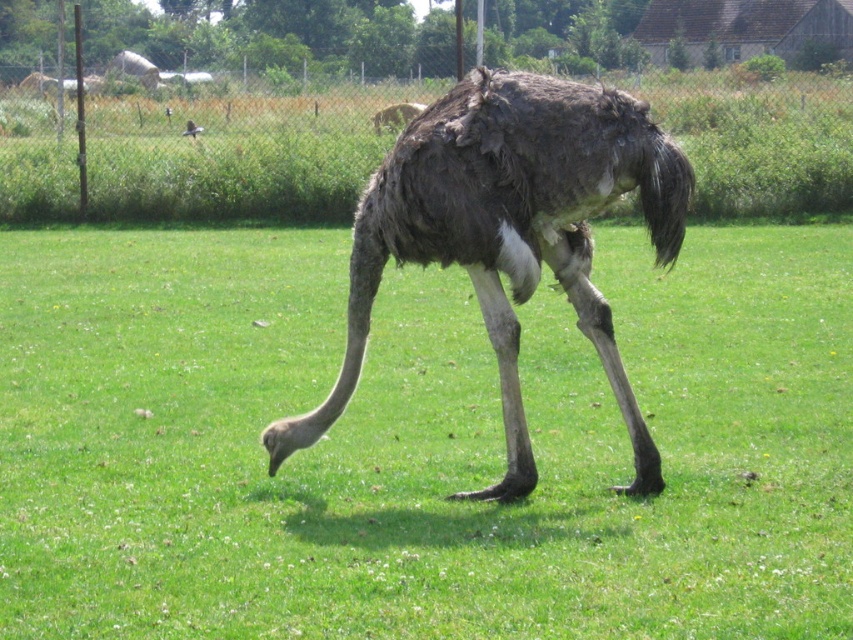
Is dark brown feathers at center positioned at the back of brown feathered ostrich at center?

No, it is not.

Between point (548, 192) and point (399, 106), which one is positioned behind?

The point (399, 106) is more distant.

Find the location of a particular element. The height and width of the screenshot is (640, 853). dark brown feathers at center is located at coordinates (509, 232).

Can you confirm if green grass at center is shorter than dark brown feathers at center?

Correct, green grass at center is not as tall as dark brown feathers at center.

Does green grass at center lie behind dark brown feathers at center?

No, green grass at center is in front of dark brown feathers at center.

You are a GUI agent. You are given a task and a screenshot of the screen. Output one action in this format:
    pyautogui.click(x=<x>, y=<y>)
    Task: Click on the green grass at center
    The height and width of the screenshot is (640, 853).
    Given the screenshot: What is the action you would take?
    pyautogui.click(x=418, y=444)

I want to click on green grass at center, so click(418, 444).

Who is more distant from viewer, (422, 106) or (181, 134)?

The point (181, 134) is behind.

Between brown feathered ostrich at center and shiny black bird at upper left, which one appears on the left side from the viewer's perspective?

Positioned to the left is shiny black bird at upper left.

Is point (383, 122) behind point (199, 125)?

No, it is not.

In order to click on brown feathered ostrich at center in this screenshot , I will do `click(396, 115)`.